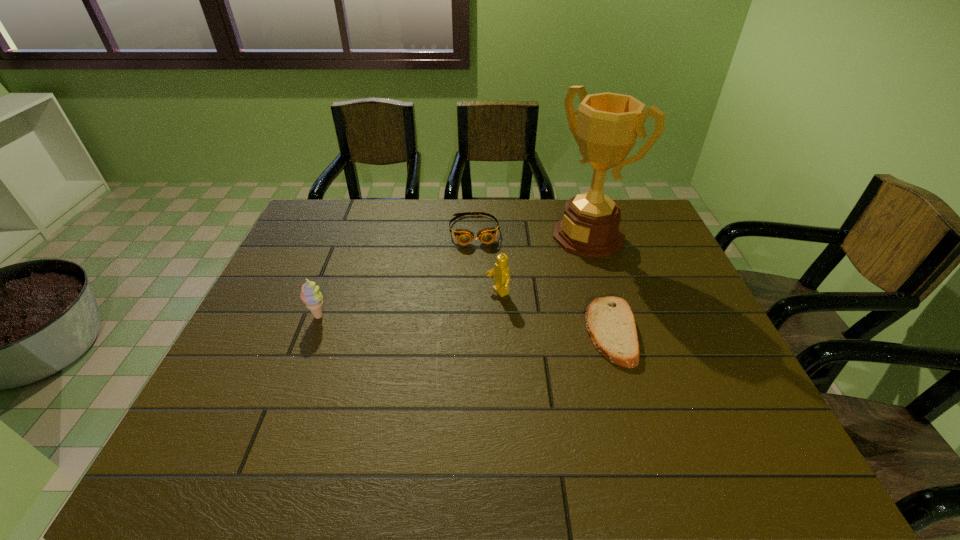
This screenshot has height=540, width=960. What are the coordinates of `free location that satisfies the following two spatial constraints: 1. on the back side of the goggles; 2. on the right side of the leftmost object` in the screenshot? It's located at (351, 231).

Locate an element on the screen. This screenshot has width=960, height=540. free region that satisfies the following two spatial constraints: 1. on the front side of the goggles; 2. on the left side of the Lego is located at coordinates (473, 293).

Identify the location of free space that satisfies the following two spatial constraints: 1. on the front side of the goggles; 2. on the left side of the tallest object. This screenshot has width=960, height=540. (474, 236).